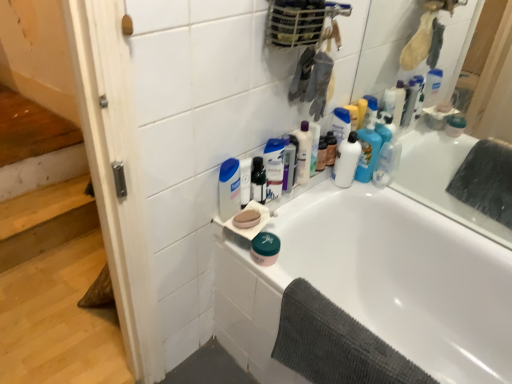
Question: In the image, is pink matte soap at upper center positioned in front of or behind dark gray textured towel at lower right?

Choices:
 (A) front
 (B) behind

Answer: (B)

Question: From a real-world perspective, is pink matte soap at upper center above or below dark gray textured towel at lower right?

Choices:
 (A) above
 (B) below

Answer: (A)

Question: Which object is positioned farthest from the pink matte soap at upper center?

Choices:
 (A) clear plastic bottle at upper center, the second cleaning product when ordered from front to back
 (B) white matte shaving cream at upper center
 (C) dark gray textured towel at lower right
 (D) green matte jar at lower center
 (E) white matte lotion at upper right, marked as the third cleaning product in a right-to-left arrangement

Answer: (C)

Question: Considering the real-world distances, which object is farthest from the pink matte soap at upper center?

Choices:
 (A) green matte jar at lower center
 (B) white glossy bathtub at upper right
 (C) wooden stairs at left
 (D) dark gray textured towel at lower right
 (E) white glossy bottle at upper right, which is the third cleaning product in front-to-back order

Answer: (C)